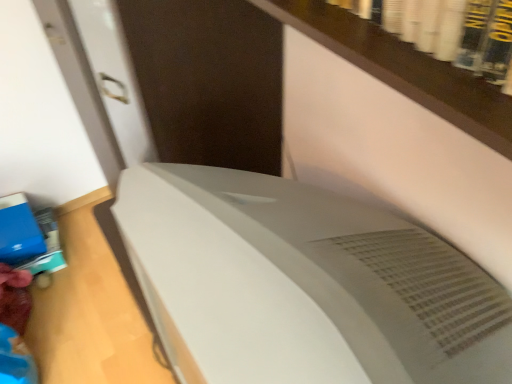
Measure the distance between point (337, 369) and camera.

Point (337, 369) is 17.95 inches away from camera.

I want to click on satin white air conditioner at center, so click(304, 285).

Describe the element at coordinates (304, 285) in the screenshot. Image resolution: width=512 pixels, height=384 pixels. I see `satin white air conditioner at center` at that location.

This screenshot has width=512, height=384. What do you see at coordinates (19, 231) in the screenshot?
I see `blue matte book at lower left` at bounding box center [19, 231].

At what (x,y) coordinates should I click in order to perform the action: click on blue matte book at lower left. Please return your answer as a coordinate pair (x, y). Looking at the image, I should click on (19, 231).

At what (x,y) coordinates should I click in order to perform the action: click on satin white air conditioner at center. Please return your answer as a coordinate pair (x, y). This screenshot has width=512, height=384. Looking at the image, I should click on (304, 285).

Which object is positioned more to the right, blue matte book at lower left or satin white air conditioner at center?

Positioned to the right is satin white air conditioner at center.

Consider the image. Relative to satin white air conditioner at center, is blue matte book at lower left in front or behind?

Clearly, blue matte book at lower left is behind satin white air conditioner at center.

Is point (37, 228) closer or farther from the camera than point (461, 356)?

Clearly, point (37, 228) is more distant from the camera than point (461, 356).

From the image's perspective, which one is positioned higher, blue matte book at lower left or satin white air conditioner at center?

blue matte book at lower left appears higher in the image.

From a real-world perspective, is blue matte book at lower left beneath satin white air conditioner at center?

Yes, from a real-world perspective, blue matte book at lower left is below satin white air conditioner at center.

From the picture: Is blue matte book at lower left thinner than satin white air conditioner at center?

Yes, blue matte book at lower left is thinner than satin white air conditioner at center.

Between blue matte book at lower left and satin white air conditioner at center, which one has less height?

blue matte book at lower left.

Between blue matte book at lower left and satin white air conditioner at center, which one has larger size?

satin white air conditioner at center.

Is blue matte book at lower left completely or partially outside of satin white air conditioner at center?

Absolutely, blue matte book at lower left is external to satin white air conditioner at center.

Is blue matte book at lower left not close to satin white air conditioner at center?

That's right, there is a large distance between blue matte book at lower left and satin white air conditioner at center.

Could you tell me if blue matte book at lower left is turned towards satin white air conditioner at center?

No, blue matte book at lower left does not turn towards satin white air conditioner at center.

Can you tell me how much blue matte book at lower left and satin white air conditioner at center differ in facing direction?

91 degrees.

Measure the distance between blue matte book at lower left and satin white air conditioner at center.

blue matte book at lower left and satin white air conditioner at center are 1.43 meters apart from each other.

This screenshot has height=384, width=512. In order to click on home appliance in front of the blue matte book at lower left in this screenshot , I will do `click(304, 285)`.

Between satin white air conditioner at center and blue matte book at lower left, which one appears on the left side from the viewer's perspective?

blue matte book at lower left is more to the left.

Is satin white air conditioner at center in front of blue matte book at lower left?

Yes, it is in front of blue matte book at lower left.

Is point (283, 182) farther from camera compared to point (32, 240)?

That is False.

From the image's perspective, between satin white air conditioner at center and blue matte book at lower left, which one is located above?

blue matte book at lower left.

From a real-world perspective, who is located lower, satin white air conditioner at center or blue matte book at lower left?

blue matte book at lower left is physically lower.

Considering the sizes of satin white air conditioner at center and blue matte book at lower left in the image, is satin white air conditioner at center wider or thinner than blue matte book at lower left?

Clearly, satin white air conditioner at center has more width compared to blue matte book at lower left.

Which of these two, satin white air conditioner at center or blue matte book at lower left, stands taller?

satin white air conditioner at center is taller.

Considering the sizes of objects satin white air conditioner at center and blue matte book at lower left in the image provided, who is bigger, satin white air conditioner at center or blue matte book at lower left?

Bigger between the two is satin white air conditioner at center.

From the picture: Is satin white air conditioner at center inside the boundaries of blue matte book at lower left, or outside?

satin white air conditioner at center lies outside blue matte book at lower left.

Can you see satin white air conditioner at center touching blue matte book at lower left?

No.

Is satin white air conditioner at center turned away from blue matte book at lower left?

No, satin white air conditioner at center is not facing the opposite direction of blue matte book at lower left.

From the picture: How many degrees apart are the facing directions of satin white air conditioner at center and blue matte book at lower left?

91 degrees.

In the scene shown: How far apart are satin white air conditioner at center and blue matte book at lower left?

satin white air conditioner at center is 4.68 feet from blue matte book at lower left.

Locate an element on the screen. The height and width of the screenshot is (384, 512). paperback book behind the satin white air conditioner at center is located at coordinates (19, 231).

Locate an element on the screen. home appliance on the right of the blue matte book at lower left is located at coordinates (304, 285).

Where is `home appliance located below the blue matte book at lower left (from the image's perspective)`? This screenshot has height=384, width=512. home appliance located below the blue matte book at lower left (from the image's perspective) is located at coordinates (304, 285).